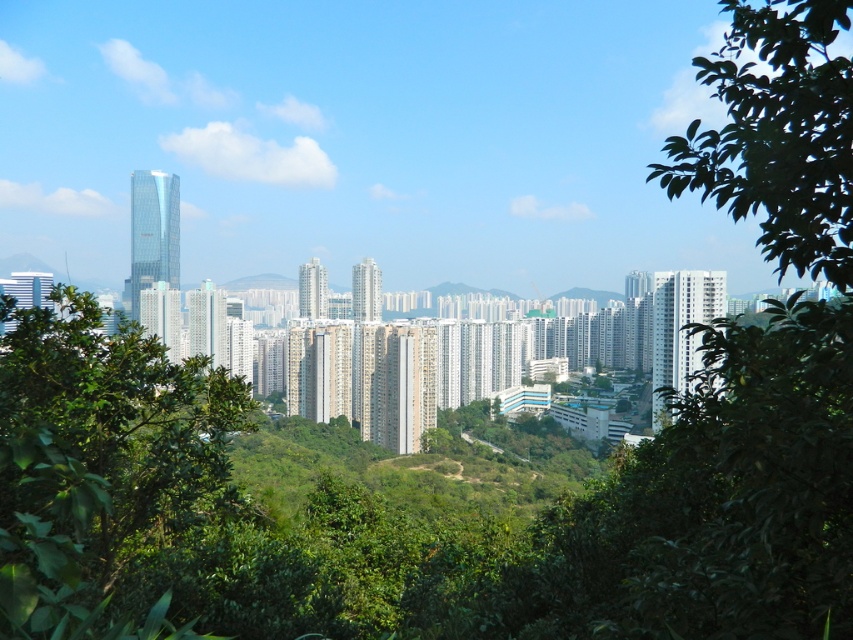
Question: From the image, what is the correct spatial relationship of green leafy tree at left in relation to green leafy tree at upper right?

Choices:
 (A) below
 (B) above

Answer: (A)

Question: Which object is farther from the camera taking this photo?

Choices:
 (A) green leafy tree at left
 (B) green leafy tree at upper right

Answer: (B)

Question: Considering the relative positions of green leafy tree at left and green leafy tree at upper right in the image provided, where is green leafy tree at left located with respect to green leafy tree at upper right?

Choices:
 (A) below
 (B) above

Answer: (A)

Question: Which point is closer to the camera taking this photo?

Choices:
 (A) (137, 353)
 (B) (737, 113)

Answer: (A)

Question: Does green leafy tree at left come behind green leafy tree at upper right?

Choices:
 (A) yes
 (B) no

Answer: (B)